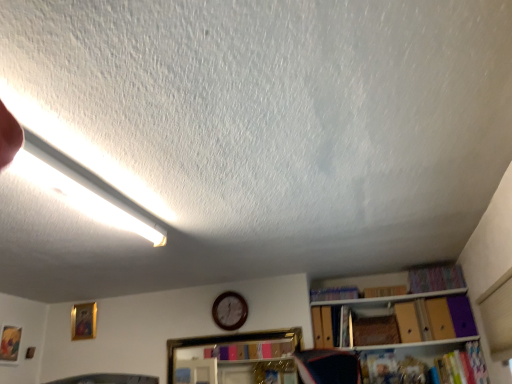
What is the approximate height of gold-framed picture at upper left, the 2th picture frame from the left?

gold-framed picture at upper left, the 2th picture frame from the left, is 14.62 inches in height.

Image resolution: width=512 pixels, height=384 pixels. What do you see at coordinates (435, 278) in the screenshot?
I see `multicolored fabric book at upper right, marked as the 4th book in a bottom-to-top arrangement` at bounding box center [435, 278].

Image resolution: width=512 pixels, height=384 pixels. Identify the location of matte purple book at lower right, marked as the first book in a bottom-to-top arrangement. click(x=463, y=366).

The width and height of the screenshot is (512, 384). Find the location of `wooden clock at center`. wooden clock at center is located at coordinates (230, 311).

The image size is (512, 384). Describe the element at coordinates (334, 293) in the screenshot. I see `blue fabric book at center, which appears as the 2th book when ordered from the bottom` at that location.

Locate an element on the screen. This screenshot has height=384, width=512. blue fabric book at center, acting as the third book starting from the top is located at coordinates (334, 293).

In order to click on gold-framed picture at upper left, the 2th picture frame from the left in this screenshot , I will do `click(83, 321)`.

From the image's perspective, relative to multicolored fabric book at upper right, the 1th book from the top, is matte purple book at lower right, marked as the first book in a bottom-to-top arrangement, above or below?

Based on their image positions, matte purple book at lower right, marked as the first book in a bottom-to-top arrangement, is located beneath multicolored fabric book at upper right, the 1th book from the top.

Which point is more distant from viewer, [465,381] or [426,270]?

The point [426,270] is more distant.

Which is correct: matte purple book at lower right, marked as the first book in a bottom-to-top arrangement, is inside multicolored fabric book at upper right, the 1th book from the top, or outside of it?

matte purple book at lower right, marked as the first book in a bottom-to-top arrangement, is not enclosed by multicolored fabric book at upper right, the 1th book from the top.

From a real-world perspective, between matte purple book at lower right, marked as the fourth book in a top-to-bottom arrangement, and multicolored fabric book at upper right, marked as the 4th book in a bottom-to-top arrangement, who is vertically higher?

From a 3D spatial view, multicolored fabric book at upper right, marked as the 4th book in a bottom-to-top arrangement, is above.

Does multicolored fabric book at upper right, the 1th book from the top, turn towards matte gold picture frame at lower left, acting as the first picture frame starting from the front?

No.

From a real-world perspective, which is physically below, multicolored fabric book at upper right, marked as the 4th book in a bottom-to-top arrangement, or matte gold picture frame at lower left, arranged as the 2th picture frame when viewed from the right?

matte gold picture frame at lower left, arranged as the 2th picture frame when viewed from the right, is physically lower.

Based on the photo, from the image's perspective, which is above, multicolored fabric book at upper right, the 1th book from the top, or matte gold picture frame at lower left, the 2th picture frame viewed from the back?

From the image's view, multicolored fabric book at upper right, the 1th book from the top, is above.

Which is less distant, (441, 282) or (8, 325)?

Point (441, 282) appears to be closer to the viewer than point (8, 325).

Considering the sizes of gold-framed picture at upper left, marked as the 1th picture frame in a back-to-front arrangement, and multicolored fabric book at upper right, the 1th book from the top, in the image, is gold-framed picture at upper left, marked as the 1th picture frame in a back-to-front arrangement, bigger or smaller than multicolored fabric book at upper right, the 1th book from the top,?

Considering their sizes, gold-framed picture at upper left, marked as the 1th picture frame in a back-to-front arrangement, takes up less space than multicolored fabric book at upper right, the 1th book from the top.

Do you think gold-framed picture at upper left, marked as the 1th picture frame in a back-to-front arrangement, is within multicolored fabric book at upper right, marked as the 4th book in a bottom-to-top arrangement, or outside of it?

gold-framed picture at upper left, marked as the 1th picture frame in a back-to-front arrangement, is located beyond the bounds of multicolored fabric book at upper right, marked as the 4th book in a bottom-to-top arrangement.

Is point (75, 318) positioned after point (453, 288)?

That is True.

At what (x,y) coordinates should I click in order to perform the action: click on the 1st picture frame positioned below the multicolored fabric book at upper right, marked as the 4th book in a bottom-to-top arrangement (from the image's perspective). Please return your answer as a coordinate pair (x, y). The width and height of the screenshot is (512, 384). Looking at the image, I should click on coord(83,321).

How many degrees apart are the facing directions of purple cardboard book at upper right, the third book ordered from the bottom, and blue fabric book at center, which appears as the 2th book when ordered from the bottom?

They differ by 4.11 degrees in their facing directions.

Is purple cardboard book at upper right, the third book ordered from the bottom, inside the boundaries of blue fabric book at center, acting as the third book starting from the top, or outside?

purple cardboard book at upper right, the third book ordered from the bottom, is outside blue fabric book at center, acting as the third book starting from the top.

Is purple cardboard book at upper right, placed as the second book when sorted from top to bottom, positioned before blue fabric book at center, which appears as the 2th book when ordered from the bottom?

Yes, it is.

Visually, is purple cardboard book at upper right, the third book ordered from the bottom, positioned to the left or to the right of blue fabric book at center, which appears as the 2th book when ordered from the bottom?

Clearly, purple cardboard book at upper right, the third book ordered from the bottom, is on the right of blue fabric book at center, which appears as the 2th book when ordered from the bottom, in the image.

What's the angular difference between gold-framed picture at upper left, the 2th picture frame from the left, and wooden shelf at center's facing directions?

There is a 0.268-degree angle between the facing directions of gold-framed picture at upper left, the 2th picture frame from the left, and wooden shelf at center.

Is gold-framed picture at upper left, marked as the 1th picture frame in a back-to-front arrangement, further to the viewer compared to wooden shelf at center?

Yes, gold-framed picture at upper left, marked as the 1th picture frame in a back-to-front arrangement, is further from the viewer.

In the scene shown: Which of these two, gold-framed picture at upper left, which is counted as the 2th picture frame, starting from the front, or wooden shelf at center, is smaller?

gold-framed picture at upper left, which is counted as the 2th picture frame, starting from the front, is smaller.

Considering the relative sizes of gold-framed picture at upper left, the 2th picture frame from the left, and wooden shelf at center in the image provided, is gold-framed picture at upper left, the 2th picture frame from the left, thinner than wooden shelf at center?

Indeed, gold-framed picture at upper left, the 2th picture frame from the left, has a lesser width compared to wooden shelf at center.

Does multicolored fabric book at upper right, marked as the 4th book in a bottom-to-top arrangement, come behind gold-framed picture at upper left, the 2th picture frame from the left?

No, it is in front of gold-framed picture at upper left, the 2th picture frame from the left.

Would you say multicolored fabric book at upper right, marked as the 4th book in a bottom-to-top arrangement, is inside or outside gold-framed picture at upper left, marked as the 1th picture frame in a back-to-front arrangement?

The correct answer is: outside.

Is multicolored fabric book at upper right, the 1th book from the top, turned away from gold-framed picture at upper left, the 2th picture frame from the left?

No, gold-framed picture at upper left, the 2th picture frame from the left, is not at the back of multicolored fabric book at upper right, the 1th book from the top.

Considering the relative positions of multicolored fabric book at upper right, the 1th book from the top, and gold-framed picture at upper left, which is counted as the 2th picture frame, starting from the front, in the image provided, is multicolored fabric book at upper right, the 1th book from the top, to the right of gold-framed picture at upper left, which is counted as the 2th picture frame, starting from the front, from the viewer's perspective?

Correct, you'll find multicolored fabric book at upper right, the 1th book from the top, to the right of gold-framed picture at upper left, which is counted as the 2th picture frame, starting from the front.

Could you tell me if white fluorescent tube at upper left is facing wooden shelf at center?

No, white fluorescent tube at upper left is not facing towards wooden shelf at center.

Is white fluorescent tube at upper left inside the boundaries of wooden shelf at center, or outside?

white fluorescent tube at upper left is not enclosed by wooden shelf at center.

Does white fluorescent tube at upper left appear on the left side of wooden shelf at center?

Correct, you'll find white fluorescent tube at upper left to the left of wooden shelf at center.

Considering the sizes of white fluorescent tube at upper left and wooden shelf at center in the image, is white fluorescent tube at upper left wider or thinner than wooden shelf at center?

white fluorescent tube at upper left is wider than wooden shelf at center.

Which book is the 1st one when counting from the left side of the matte purple book at lower right, marked as the first book in a bottom-to-top arrangement? Please provide its 2D coordinates.

[(435, 278)]

From the matte gold picture frame at lower left, acting as the first picture frame starting from the front, count 3rd books forward and point to it. Please provide its 2D coordinates.

[(435, 278)]

Looking at the image, which one is located further to matte gold picture frame at lower left, acting as the first picture frame starting from the front, blue fabric book at center, which appears as the 2th book when ordered from the bottom, or multicolored fabric book at upper right, the 1th book from the top?

multicolored fabric book at upper right, the 1th book from the top, is positioned further to the anchor matte gold picture frame at lower left, acting as the first picture frame starting from the front.

Considering their positions, is matte purple book at lower right, marked as the fourth book in a top-to-bottom arrangement, positioned closer to wooden clock at center than blue fabric book at center, which appears as the 2th book when ordered from the bottom?

Among the two, blue fabric book at center, which appears as the 2th book when ordered from the bottom, is located nearer to wooden clock at center.

Estimate the real-world distances between objects in this image. Which object is closer to white fluorescent tube at upper left, matte gold picture frame at lower left, the 2th picture frame viewed from the back, or blue fabric book at center, acting as the third book starting from the top?

Based on the image, blue fabric book at center, acting as the third book starting from the top, appears to be nearer to white fluorescent tube at upper left.

From the image, which object appears to be farther from matte purple book at lower right, marked as the first book in a bottom-to-top arrangement, gold-framed picture at upper left, arranged as the first picture frame when viewed from the right, or multicolored fabric book at upper right, the 1th book from the top?

Based on the image, gold-framed picture at upper left, arranged as the first picture frame when viewed from the right, appears to be further to matte purple book at lower right, marked as the first book in a bottom-to-top arrangement.

When comparing their distances from matte gold picture frame at lower left, positioned as the 1th picture frame in left-to-right order, does white fluorescent tube at upper left or gold-framed picture at upper left, arranged as the first picture frame when viewed from the right, seem further?

The object further to matte gold picture frame at lower left, positioned as the 1th picture frame in left-to-right order, is white fluorescent tube at upper left.

Looking at the image, which one is located closer to matte gold picture frame at lower left, acting as the first picture frame starting from the front, purple cardboard book at upper right, placed as the second book when sorted from top to bottom, or blue fabric book at center, acting as the third book starting from the top?

blue fabric book at center, acting as the third book starting from the top.

Looking at the image, which one is located closer to matte gold picture frame at lower left, positioned as the 1th picture frame in left-to-right order, matte purple book at lower right, marked as the fourth book in a top-to-bottom arrangement, or multicolored fabric book at upper right, marked as the 4th book in a bottom-to-top arrangement?

Based on the image, multicolored fabric book at upper right, marked as the 4th book in a bottom-to-top arrangement, appears to be nearer to matte gold picture frame at lower left, positioned as the 1th picture frame in left-to-right order.

Considering their positions, is blue fabric book at center, which appears as the 2th book when ordered from the bottom, positioned further to matte purple book at lower right, marked as the first book in a bottom-to-top arrangement, than matte gold picture frame at lower left, acting as the first picture frame starting from the front?

The object further to matte purple book at lower right, marked as the first book in a bottom-to-top arrangement, is matte gold picture frame at lower left, acting as the first picture frame starting from the front.

This screenshot has height=384, width=512. In order to click on picture frame situated between matte gold picture frame at lower left, acting as the first picture frame starting from the front, and blue fabric book at center, acting as the third book starting from the top, from left to right in this screenshot , I will do `click(83, 321)`.

This screenshot has width=512, height=384. In order to click on picture frame between matte gold picture frame at lower left, acting as the first picture frame starting from the front, and wooden clock at center, in the horizontal direction in this screenshot , I will do `click(83, 321)`.

Identify the location of book located between wooden shelf at center and purple cardboard book at upper right, placed as the second book when sorted from top to bottom, in the left-right direction. This screenshot has height=384, width=512. (334, 293).

Find the location of `light between matte gold picture frame at lower left, positioned as the 1th picture frame in left-to-right order, and matte purple book at lower right, marked as the fourth book in a top-to-bottom arrangement, from left to right`. light between matte gold picture frame at lower left, positioned as the 1th picture frame in left-to-right order, and matte purple book at lower right, marked as the fourth book in a top-to-bottom arrangement, from left to right is located at coordinates (84, 192).